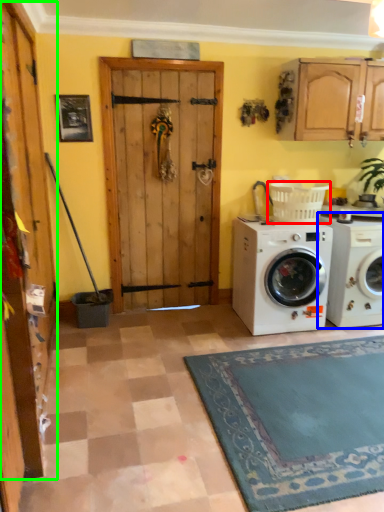
Question: Considering the real-world distances, which object is farthest from laundry basket (highlighted by a red box)? washing machine (highlighted by a blue box) or barn door (highlighted by a green box)?

Choices:
 (A) washing machine
 (B) barn door

Answer: (B)